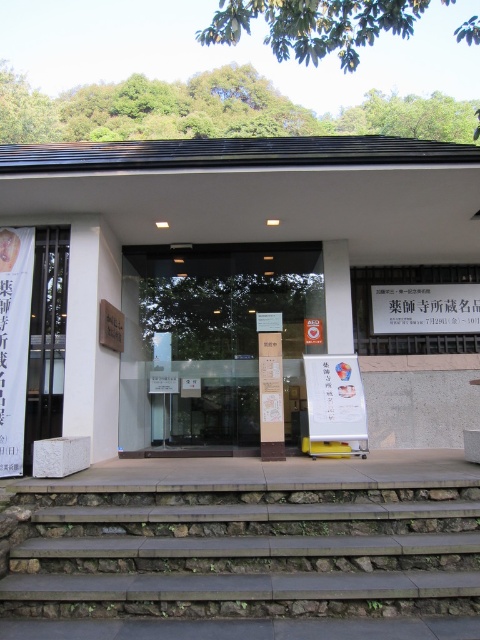
Which is below, transparent glass door at center or white paper sign at upper right?

transparent glass door at center is below.

Who is more distant from viewer, (x=263, y=301) or (x=395, y=285)?

The point (x=395, y=285) is behind.

At what (x,y) coordinates should I click in order to perform the action: click on transparent glass door at center. Please return your answer as a coordinate pair (x, y). Looking at the image, I should click on (211, 337).

Does brown stone stairs at lower center have a larger size compared to white paper sign at upper right?

Correct, brown stone stairs at lower center is larger in size than white paper sign at upper right.

Consider the image. Between brown stone stairs at lower center and white paper sign at upper right, which one is positioned higher?

white paper sign at upper right is higher up.

Which is behind, point (230, 600) or point (393, 300)?

Positioned behind is point (393, 300).

Where is `brown stone stairs at lower center`? The width and height of the screenshot is (480, 640). brown stone stairs at lower center is located at coordinates (248, 552).

Does brown stone stairs at lower center have a lesser height compared to transparent glass door at center?

Correct, brown stone stairs at lower center is not as tall as transparent glass door at center.

Is brown stone stairs at lower center further to the viewer compared to transparent glass door at center?

No.

Locate an element on the screen. The width and height of the screenshot is (480, 640). brown stone stairs at lower center is located at coordinates (248, 552).